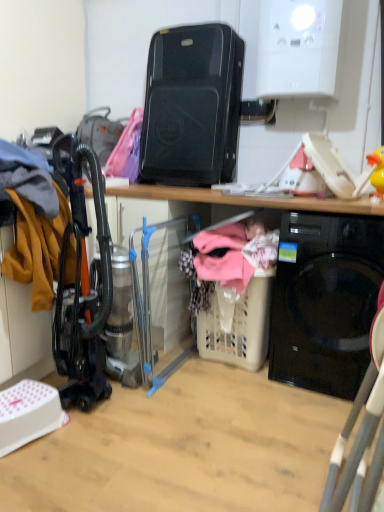
Question: Can you confirm if clear plastic laundry basket at center, the 1th appliance positioned from the bottom, is wider than beige plastic laundry basket at lower center?

Choices:
 (A) no
 (B) yes

Answer: (B)

Question: Is clear plastic laundry basket at center, which appears as the second appliance when viewed from the top, turned away from beige plastic laundry basket at lower center?

Choices:
 (A) no
 (B) yes

Answer: (A)

Question: From the image's perspective, does clear plastic laundry basket at center, the 1th appliance positioned from the bottom, appear lower than beige plastic laundry basket at lower center?

Choices:
 (A) yes
 (B) no

Answer: (B)

Question: Can you confirm if clear plastic laundry basket at center, the 1th appliance positioned from the bottom, is positioned to the right of beige plastic laundry basket at lower center?

Choices:
 (A) no
 (B) yes

Answer: (A)

Question: Considering the relative positions of clear plastic laundry basket at center, which appears as the second appliance when viewed from the top, and beige plastic laundry basket at lower center in the image provided, is clear plastic laundry basket at center, which appears as the second appliance when viewed from the top, to the left of beige plastic laundry basket at lower center from the viewer's perspective?

Choices:
 (A) yes
 (B) no

Answer: (A)

Question: From a real-world perspective, is black plastic speaker at upper center, the first appliance positioned from the top, above or below clear plastic laundry basket at center, which appears as the second appliance when viewed from the top?

Choices:
 (A) above
 (B) below

Answer: (A)

Question: Is black plastic speaker at upper center, the first appliance positioned from the top, taller or shorter than clear plastic laundry basket at center, which appears as the second appliance when viewed from the top?

Choices:
 (A) short
 (B) tall

Answer: (A)

Question: In the image, is black plastic speaker at upper center, the first appliance positioned from the top, positioned in front of or behind clear plastic laundry basket at center, the 1th appliance positioned from the bottom?

Choices:
 (A) behind
 (B) front

Answer: (A)

Question: Is black plastic speaker at upper center, positioned as the second appliance in bottom-to-top order, inside or outside of clear plastic laundry basket at center, which appears as the second appliance when viewed from the top?

Choices:
 (A) outside
 (B) inside

Answer: (A)

Question: From the image's perspective, relative to beige plastic laundry basket at lower center, is black glossy washing machine at lower right above or below?

Choices:
 (A) above
 (B) below

Answer: (A)

Question: Considering the relative positions of black glossy washing machine at lower right and beige plastic laundry basket at lower center in the image provided, is black glossy washing machine at lower right to the left or to the right of beige plastic laundry basket at lower center?

Choices:
 (A) left
 (B) right

Answer: (B)

Question: Is black glossy washing machine at lower right wider or thinner than beige plastic laundry basket at lower center?

Choices:
 (A) thin
 (B) wide

Answer: (B)

Question: Based on their sizes in the image, would you say black glossy washing machine at lower right is bigger or smaller than beige plastic laundry basket at lower center?

Choices:
 (A) big
 (B) small

Answer: (A)

Question: Considering the positions of point (259, 275) and point (147, 251), is point (259, 275) closer or farther from the camera than point (147, 251)?

Choices:
 (A) closer
 (B) farther

Answer: (A)

Question: Is beige plastic laundry basket at lower center in front of or behind clear plastic laundry basket at center, the 1th appliance positioned from the bottom, in the image?

Choices:
 (A) behind
 (B) front

Answer: (A)